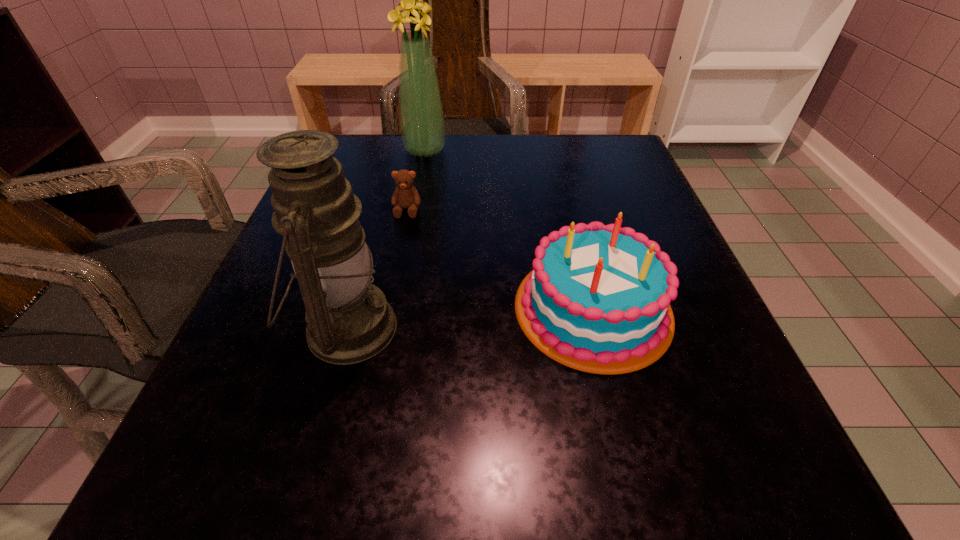
Find the location of a particular element. The height and width of the screenshot is (540, 960). bouquet is located at coordinates (422, 125).

Locate an element on the screen. The width and height of the screenshot is (960, 540). oil lamp is located at coordinates (349, 320).

Identify the location of birthday cake. The height and width of the screenshot is (540, 960). (600, 299).

Find the location of a particular element. The image size is (960, 540). the rightmost object is located at coordinates [x=600, y=299].

The width and height of the screenshot is (960, 540). Identify the location of teddy bear. (405, 195).

Identify the location of the shortest object. (405, 195).

What are the coordinates of `free point located 0.220m on the front-facing side of the bouquet` in the screenshot? It's located at (538, 150).

The width and height of the screenshot is (960, 540). In order to click on free region located 0.090m on the back of the third shortest object in this screenshot , I will do `click(370, 247)`.

Image resolution: width=960 pixels, height=540 pixels. Find the location of `vacant space located on the left of the birthday cake`. vacant space located on the left of the birthday cake is located at coordinates (324, 308).

Where is `blank space located on the face of the shortest object`? The width and height of the screenshot is (960, 540). blank space located on the face of the shortest object is located at coordinates (389, 302).